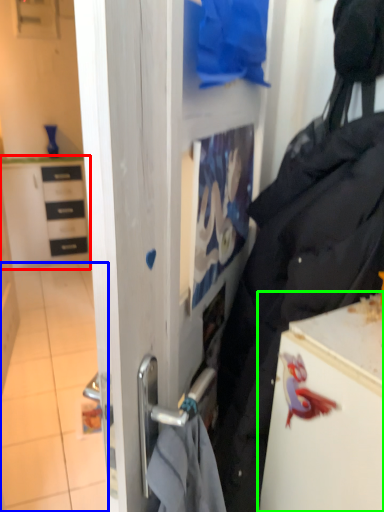
Question: Based on their relative distances, which object is nearer to cabinetry (highlighted by a red box)? Choose from tile (highlighted by a blue box) and fridge (highlighted by a green box).

Choices:
 (A) tile
 (B) fridge

Answer: (A)